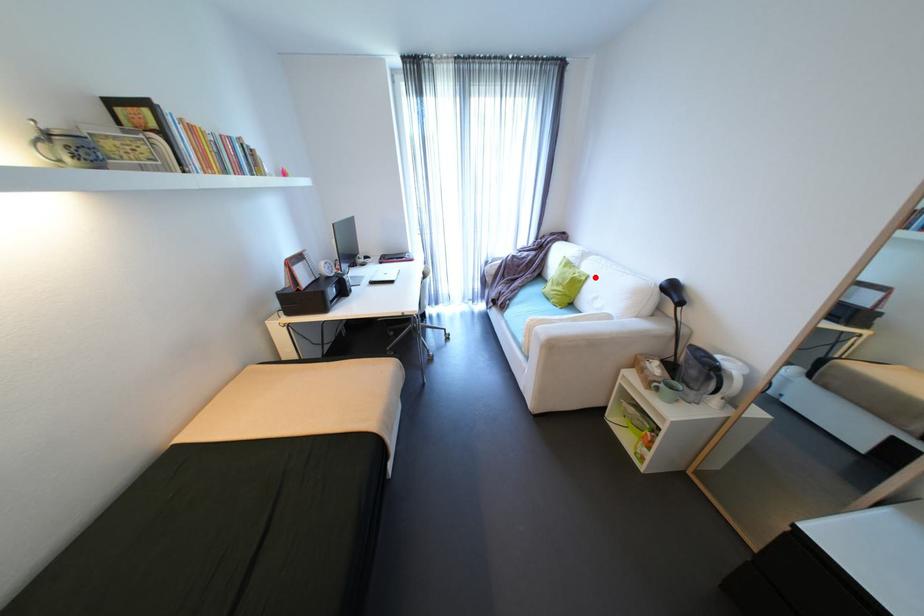
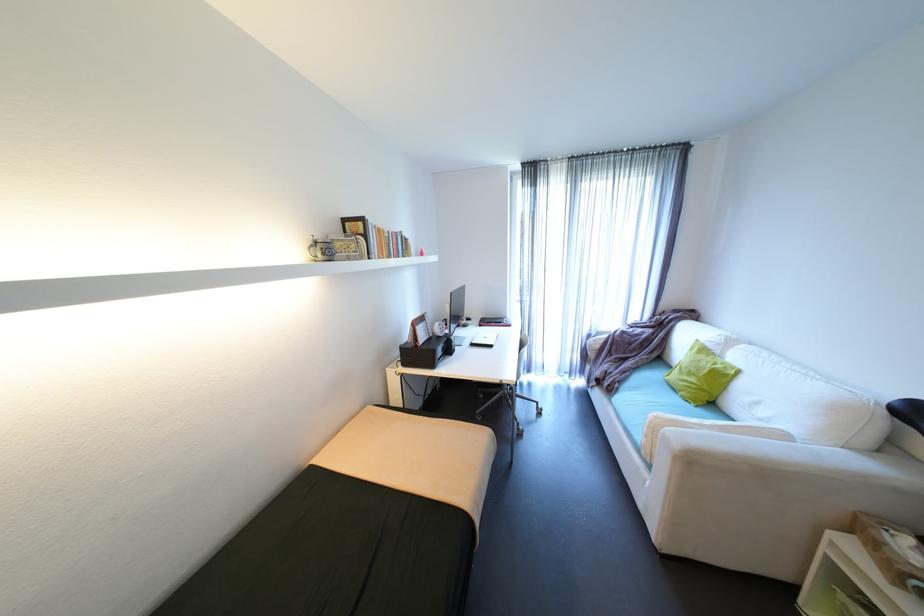
Locate, in the second image, the point that corresponds to the highlighted location in the first image.

(747, 371)